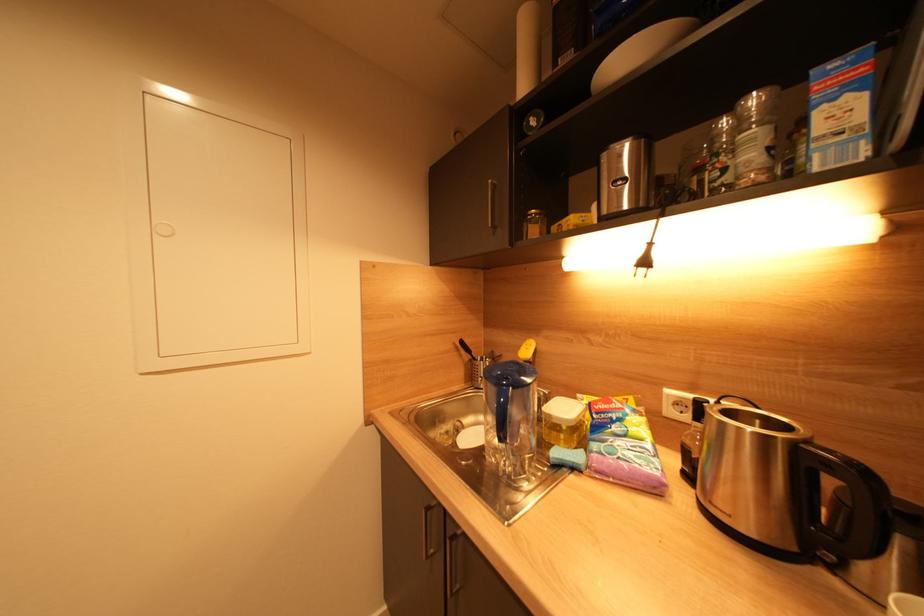
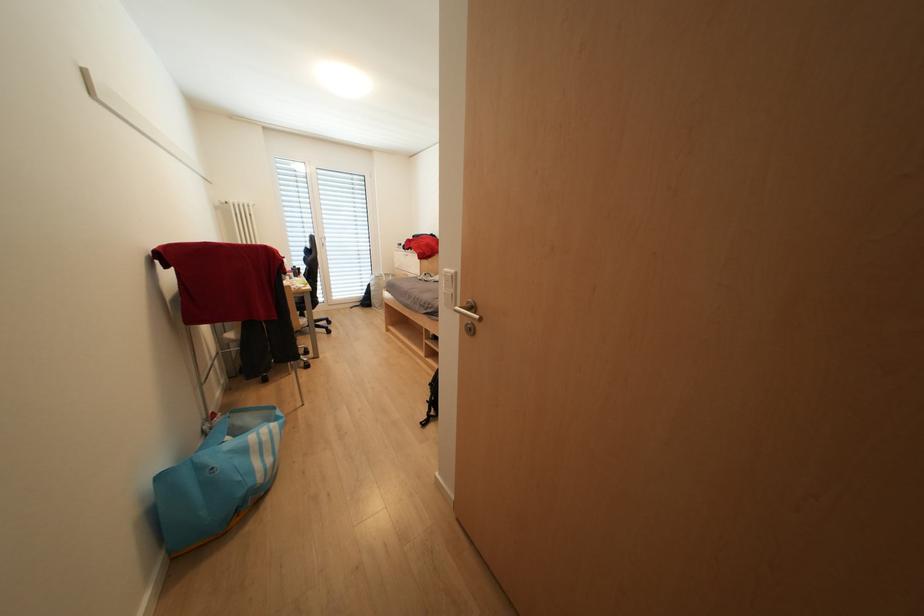
Looking at this image, which direction would the cameraman need to move to produce the second image?

The cameraman walked toward left, forward.